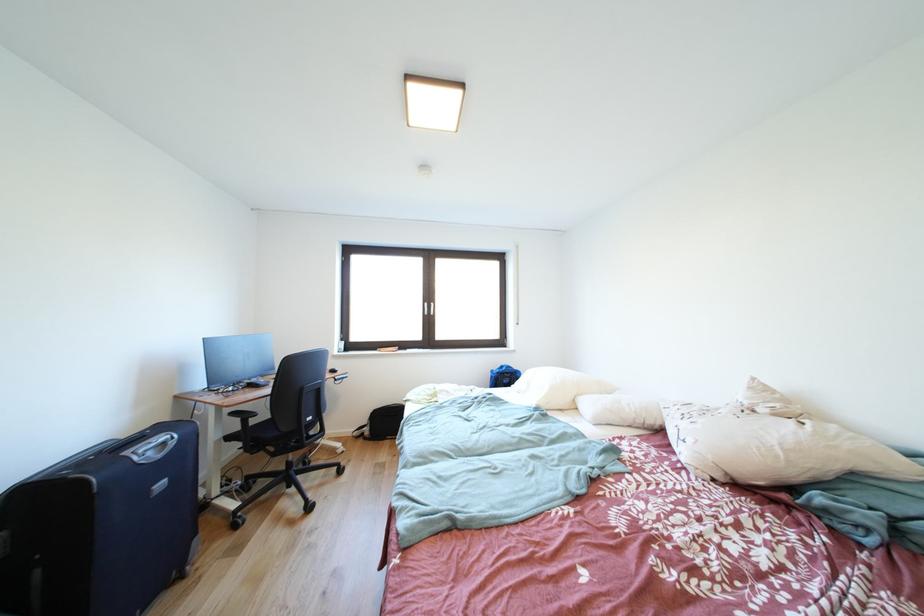
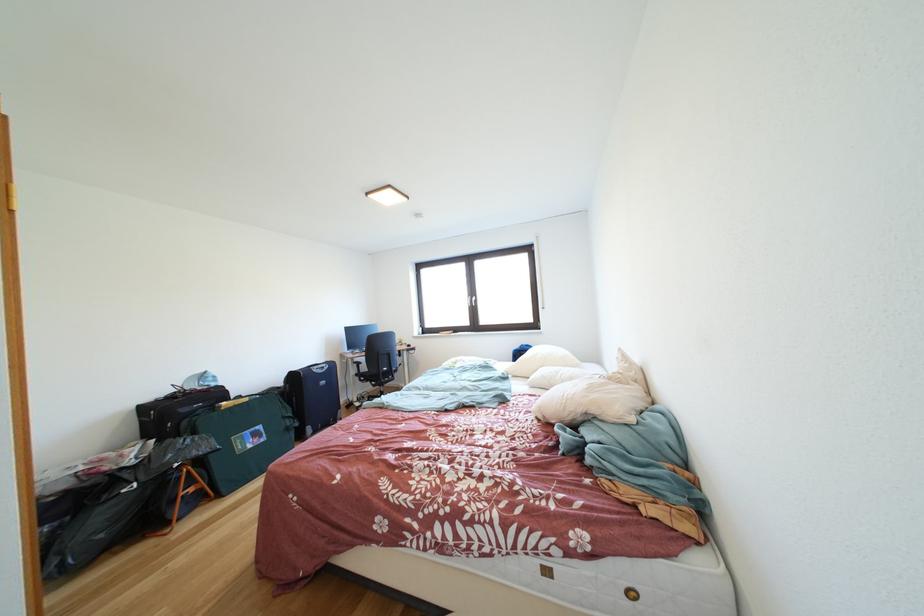
In the second image, find the point that corresponds to [283,459] in the first image.

(383, 391)